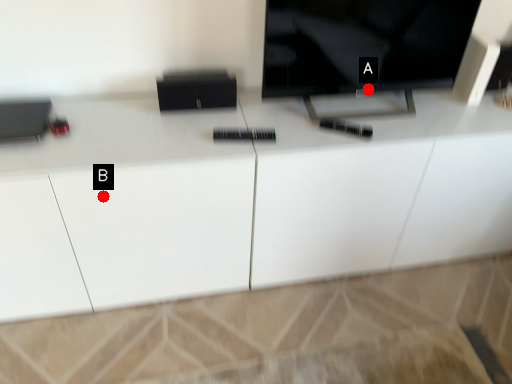
Question: Two points are circled on the image, labeled by A and B beside each circle. Which point is closer to the camera?

Choices:
 (A) A is closer
 (B) B is closer

Answer: (B)